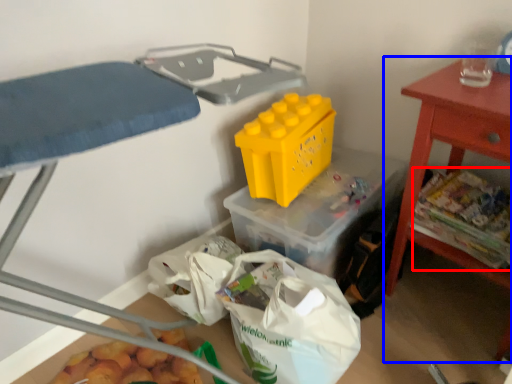
Question: Which of the following is the closest to the observer, food (highlighted by a red box) or table (highlighted by a blue box)?

Choices:
 (A) food
 (B) table

Answer: (B)